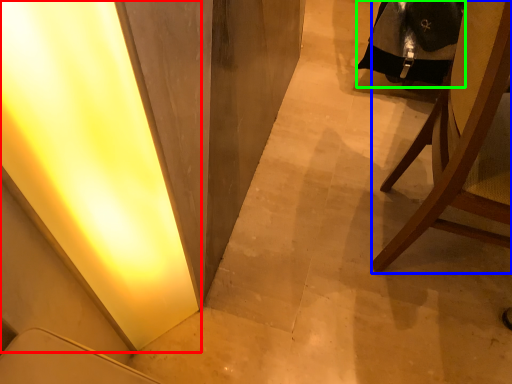
Question: Estimate the real-world distances between objects in this image. Which object is farther from light (highlighted by a red box), chair (highlighted by a blue box) or robe (highlighted by a green box)?

Choices:
 (A) chair
 (B) robe

Answer: (B)